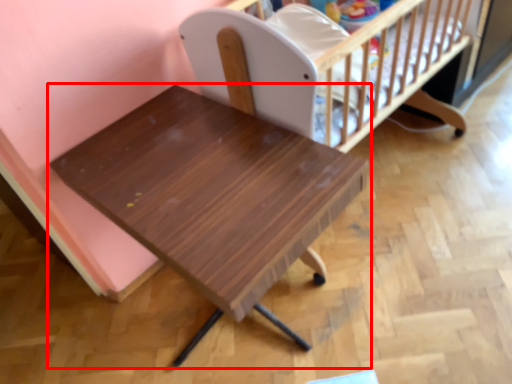
Question: Observing the image, what is the correct spatial positioning of table (annotated by the red box) in reference to infant bed?

Choices:
 (A) left
 (B) right

Answer: (A)